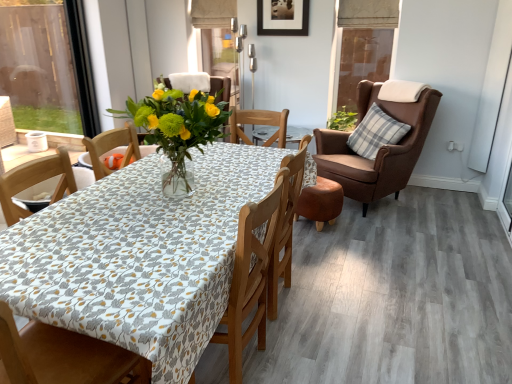
Question: Can you confirm if plaid fabric pillow at right is positioned to the left of transparent glass window screen at upper right?

Choices:
 (A) yes
 (B) no

Answer: (A)

Question: Can we say plaid fabric pillow at right lies outside transparent glass window screen at upper right?

Choices:
 (A) no
 (B) yes

Answer: (B)

Question: From a real-world perspective, is plaid fabric pillow at right located higher than transparent glass window screen at upper right?

Choices:
 (A) yes
 (B) no

Answer: (B)

Question: Does plaid fabric pillow at right have a smaller size compared to transparent glass window screen at upper right?

Choices:
 (A) yes
 (B) no

Answer: (B)

Question: From the image's perspective, would you say plaid fabric pillow at right is positioned over transparent glass window screen at upper right?

Choices:
 (A) yes
 (B) no

Answer: (B)

Question: Based on their sizes in the image, would you say green leafy plant at center is bigger or smaller than black matte picture frame at upper center?

Choices:
 (A) big
 (B) small

Answer: (A)

Question: Does point (340, 115) appear closer or farther from the camera than point (301, 13)?

Choices:
 (A) farther
 (B) closer

Answer: (A)

Question: Visually, is green leafy plant at center positioned to the left or to the right of black matte picture frame at upper center?

Choices:
 (A) left
 (B) right

Answer: (B)

Question: In the image, is green leafy plant at center positioned in front of or behind black matte picture frame at upper center?

Choices:
 (A) front
 (B) behind

Answer: (B)

Question: Is black matte picture frame at upper center wider or thinner than green leafy plant at center?

Choices:
 (A) thin
 (B) wide

Answer: (A)

Question: Is black matte picture frame at upper center to the left or to the right of green leafy plant at center in the image?

Choices:
 (A) left
 (B) right

Answer: (A)

Question: Is black matte picture frame at upper center in front of or behind green leafy plant at center in the image?

Choices:
 (A) behind
 (B) front

Answer: (B)

Question: From a real-world perspective, is black matte picture frame at upper center above or below green leafy plant at center?

Choices:
 (A) above
 (B) below

Answer: (A)

Question: Is green leafy plant at center wider or thinner than transparent glass window screen at upper right?

Choices:
 (A) thin
 (B) wide

Answer: (B)

Question: Relative to transparent glass window screen at upper right, is green leafy plant at center in front or behind?

Choices:
 (A) front
 (B) behind

Answer: (B)